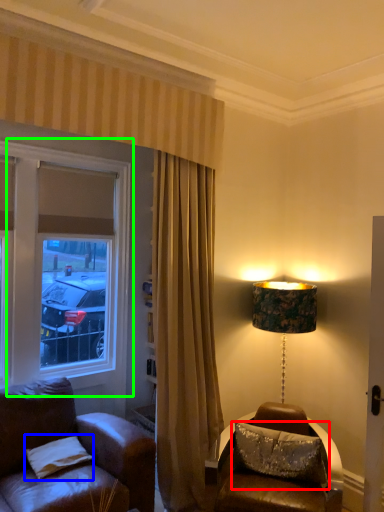
Question: Estimate the real-world distances between objects in this image. Which object is closer to pillow (highlighted by a red box), pillow (highlighted by a blue box) or window (highlighted by a green box)?

Choices:
 (A) pillow
 (B) window

Answer: (A)